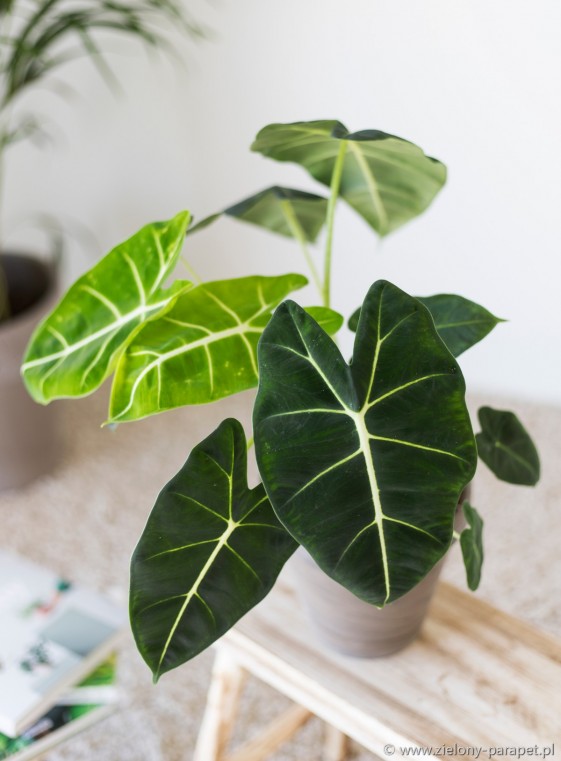
I want to click on small pot, so click(x=335, y=619).